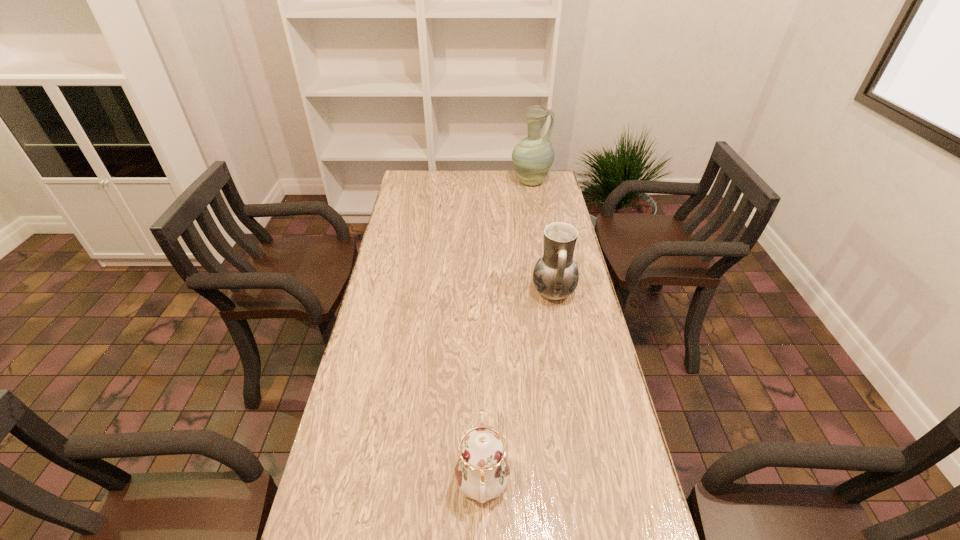
Where is `the taller pitcher`? This screenshot has height=540, width=960. the taller pitcher is located at coordinates (533, 156).

You are a GUI agent. You are given a task and a screenshot of the screen. Output one action in this format:
    pyautogui.click(x=<x>, y=<y>)
    Task: Click on the tallest object
    
    Given the screenshot: What is the action you would take?
    pyautogui.click(x=533, y=156)

At what (x,y) coordinates should I click in order to perform the action: click on the second shortest object. Please return your answer as a coordinate pair (x, y). Looking at the image, I should click on (555, 276).

The height and width of the screenshot is (540, 960). In order to click on the nearer pitcher in this screenshot , I will do `click(555, 276)`.

Identify the location of the shortest object. point(482,471).

Image resolution: width=960 pixels, height=540 pixels. I want to click on the nearest object, so click(x=482, y=471).

At what (x,y) coordinates should I click in order to perform the action: click on free space located 0.300m on the front-facing side of the shorter pitcher. Please return your answer as a coordinate pair (x, y). The width and height of the screenshot is (960, 540). Looking at the image, I should click on click(444, 292).

The width and height of the screenshot is (960, 540). I want to click on free space located 0.170m on the front-facing side of the shorter pitcher, so click(x=482, y=292).

You are a GUI agent. You are given a task and a screenshot of the screen. Output one action in this format:
    pyautogui.click(x=<x>, y=<y>)
    Task: Click on the vacant space located on the front-facing side of the shorter pitcher
    The height and width of the screenshot is (540, 960).
    Given the screenshot: What is the action you would take?
    pyautogui.click(x=441, y=292)

What are the coordinates of `free region located 0.230m on the right of the chinaware` in the screenshot? It's located at (609, 483).